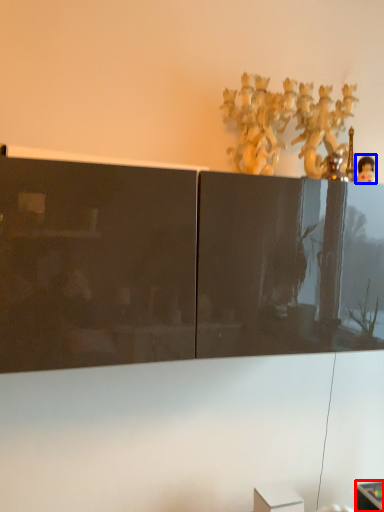
Question: Which point is further to the camera, furniture (highlighted by a red box) or toy (highlighted by a blue box)?

Choices:
 (A) furniture
 (B) toy

Answer: (A)